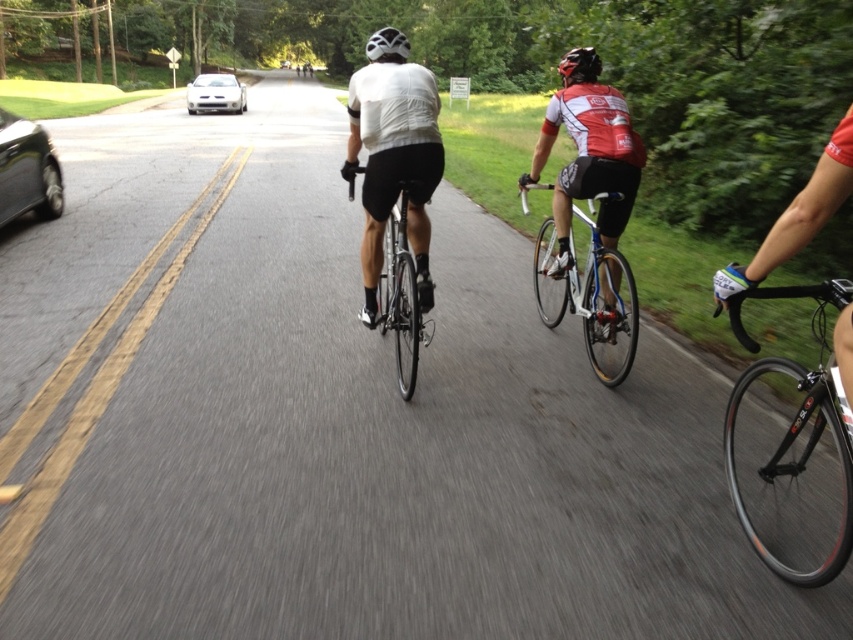
Question: Is shiny silver bicycle at center above shiny black bike at center?

Choices:
 (A) yes
 (B) no

Answer: (A)

Question: Is shiny silver bicycle at center below black matte helmet at upper center?

Choices:
 (A) no
 (B) yes

Answer: (B)

Question: Is white matte jersey at center thinner than shiny black car at left?

Choices:
 (A) yes
 (B) no

Answer: (B)

Question: Which of the following is the closest to the observer?

Choices:
 (A) (368, 227)
 (B) (550, 250)

Answer: (A)

Question: Which point appears closest to the camera in this image?

Choices:
 (A) (619, 372)
 (B) (378, 52)

Answer: (B)

Question: Estimate the real-world distances between objects in this image. Which object is farther from the shiny black bike at center?

Choices:
 (A) black matte helmet at upper center
 (B) shiny black car at left

Answer: (B)